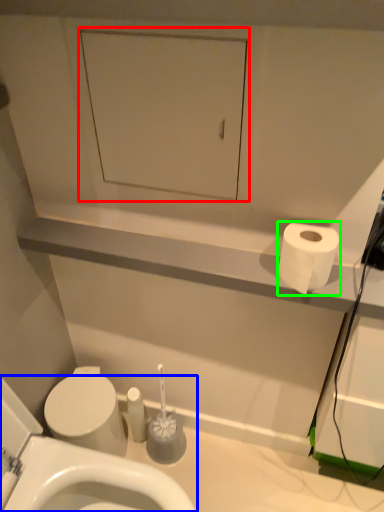
Question: Which is farther away from medicine cabinet (highlighted by a red box)? toilet (highlighted by a blue box) or toilet paper (highlighted by a green box)?

Choices:
 (A) toilet
 (B) toilet paper

Answer: (A)